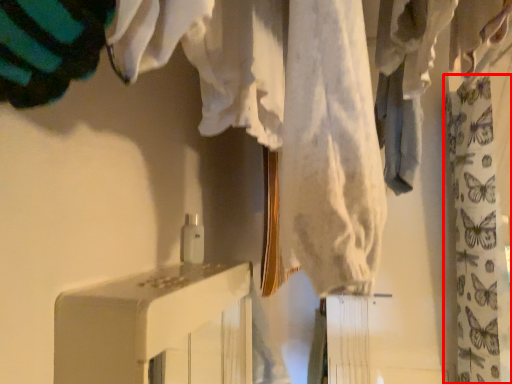
Question: From the image's perspective, considering the relative positions of curtain (annotated by the red box) and furniture in the image provided, where is curtain (annotated by the red box) located with respect to the staircase?

Choices:
 (A) above
 (B) below

Answer: (A)